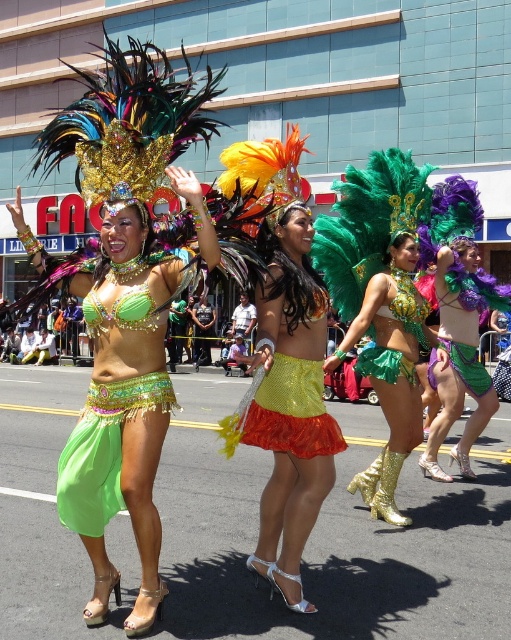
You are a photographer positioned at the center of the parade. You want to capture both performers in a single frame. Which performer, the one at point (401,362) or the one at point (472,380), should you focus on first to ensure they are in the foreground?

You should focus on the performer at point (401,362) first because it is in front of the performer at point (472,380), making it the foreground subject.

You are a photographer trying to capture the parade performers. You notice the shiny gold boots at center and the shiny purple fabric skirt at center. Which one should you focus on first if you want to photograph them from left to right order?

You should focus on the shiny gold boots at center first because it is positioned to the left of the shiny purple fabric skirt at center when viewed from left to right.

In the scene shown: You are a photographer at the parade and want to capture a photo where the shiny gold boots at center and shiny green skirt at center are both visible. Based on their positions, which object should appear lower in the photo?

Result: The shiny gold boots at center should appear lower in the photo because it is located below the shiny green skirt at center.